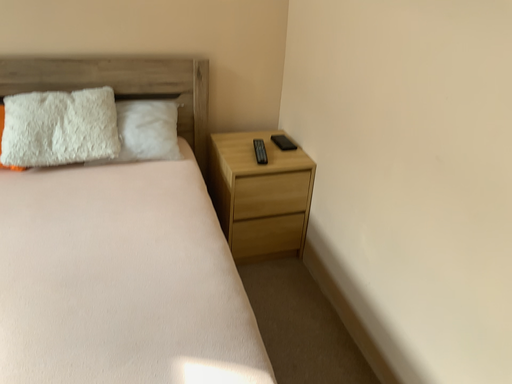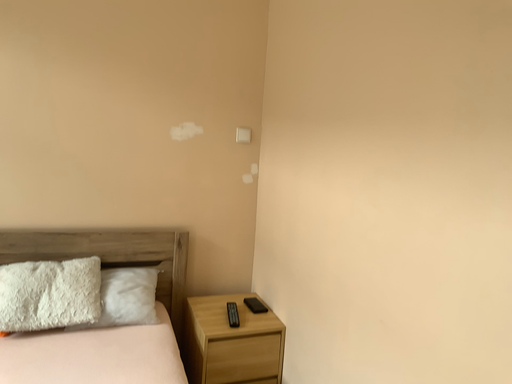
Question: Which way did the camera rotate in the video?

Choices:
 (A) rotated downward
 (B) rotated upward

Answer: (B)